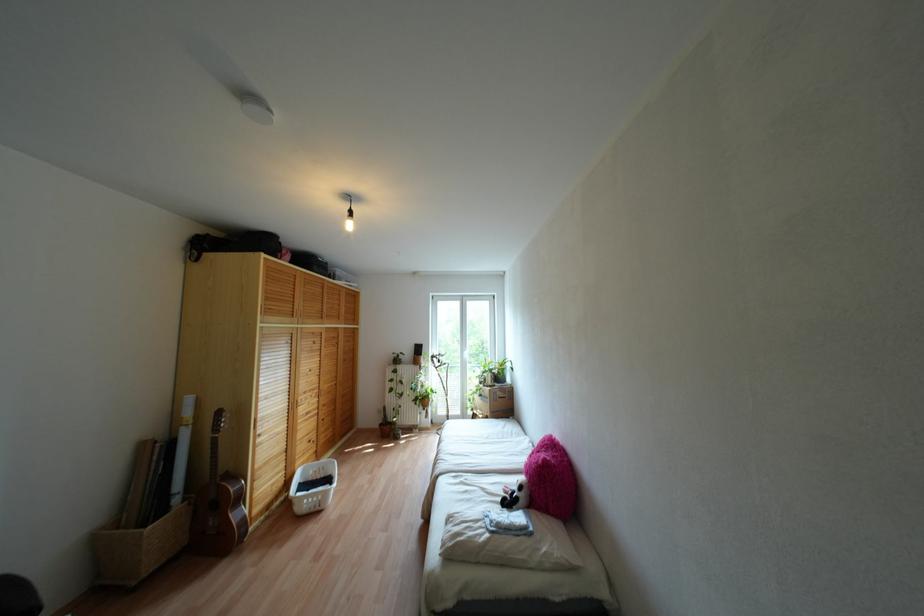
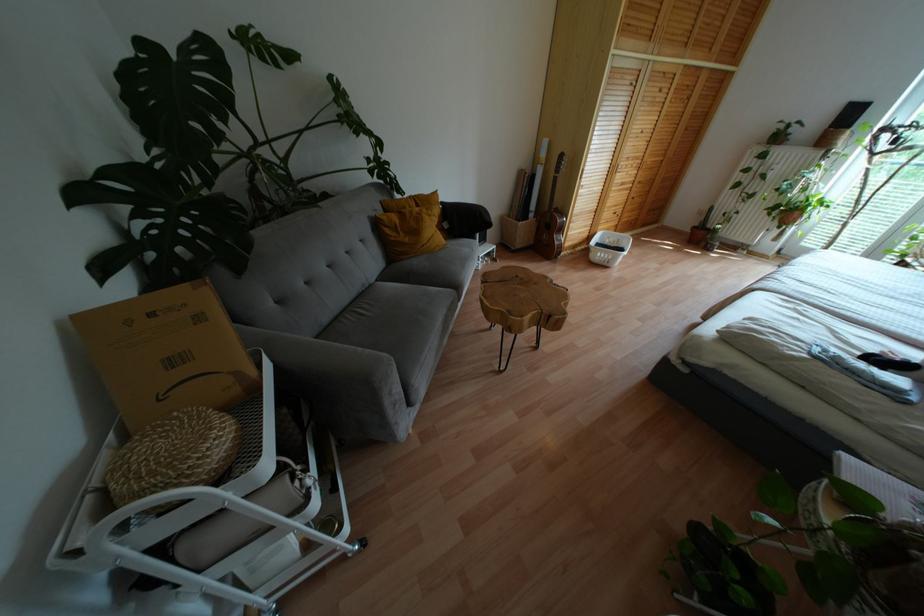
The images are taken continuously from a first-person perspective. In which direction is your viewpoint rotating?

The camera rotated toward left-down.